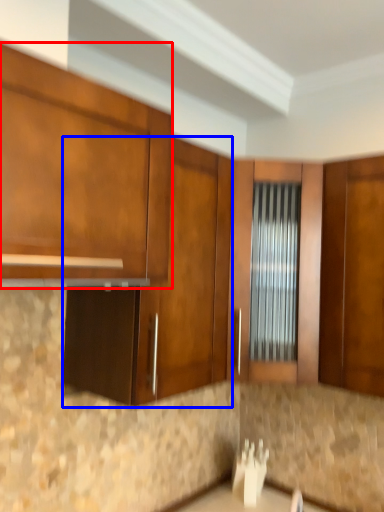
Question: Which of the following is the closest to the observer, cabinetry (highlighted by a red box) or cabinetry (highlighted by a blue box)?

Choices:
 (A) cabinetry
 (B) cabinetry

Answer: (A)